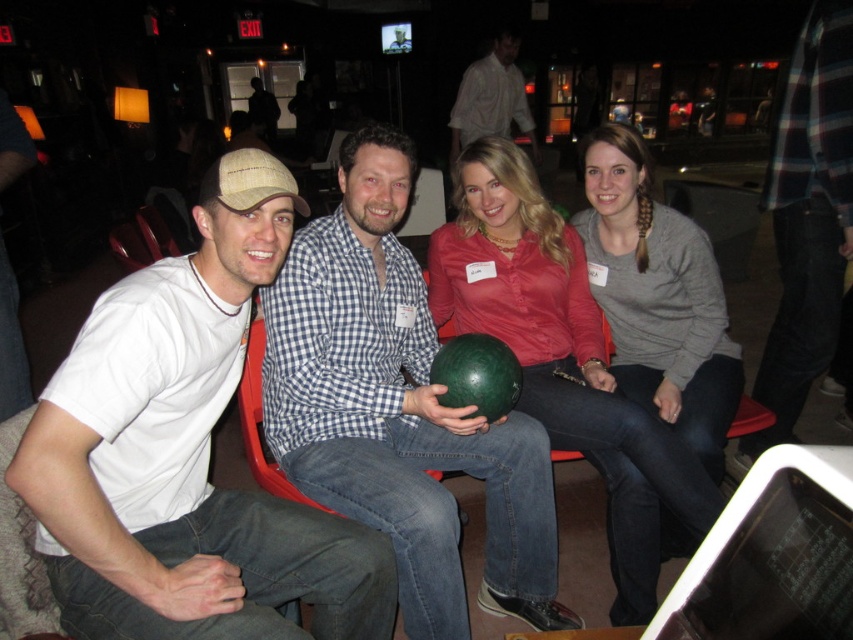
Question: Is gray cotton sweater at center thinner than plaid flannel shirt at right?

Choices:
 (A) no
 (B) yes

Answer: (A)

Question: Does plaid flannel shirt at right appear over matte black shirt at center?

Choices:
 (A) no
 (B) yes

Answer: (A)

Question: Which point is farther to the camera?

Choices:
 (A) green matte bowling ball at center
 (B) white shirt at center

Answer: (B)

Question: Among these points, which one is farthest from the camera?

Choices:
 (A) (567, 252)
 (B) (317, 538)

Answer: (A)

Question: Which object is positioned closest to the plaid flannel shirt at right?

Choices:
 (A) checkered fabric shirt at center
 (B) matte black shirt at center
 (C) white shirt at center

Answer: (A)

Question: Is matte green bowling ball at center thinner than gray cotton sweater at center?

Choices:
 (A) no
 (B) yes

Answer: (A)